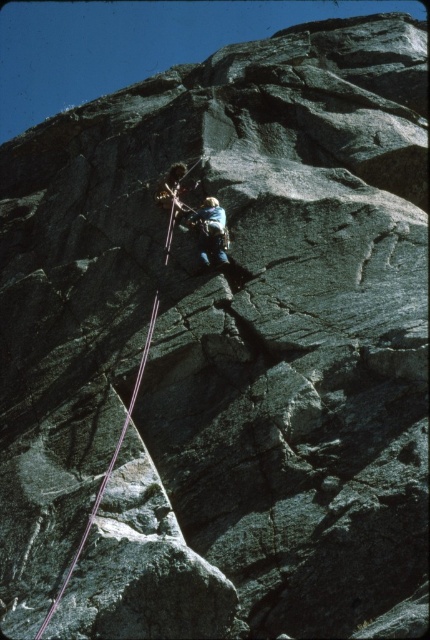
You are a rock climber assessing the climbing route. You notice two points on the rock face marked as point A at coordinates point A at point (131, 417) and point B at point (224, 241). Which point is closer to you as you stand at the base of the cliff?

Point A at point (131, 417) is closer to the viewer than point B at point (224, 241), so point A is closer to you as you stand at the base of the cliff.

You are a climber trying to reach the top of the cliff. You notice the purple synthetic rope at center. Based on its position, can you determine if it is directly below or above your current position?

The purple synthetic rope at center is located at point coordinates that are lower than your current position, so it is below you.

You are a safety inspector assessing the climbing setup. The safety regulations state that the distance between the purple synthetic rope at center and the camouflage fabric climbing harness at center must not exceed 3.5 meters. Is this setup compliant with the regulations?

The purple synthetic rope at center and the camouflage fabric climbing harness at center are 4.00 meters apart, which exceeds the maximum allowed distance of 3.5 meters. Therefore, the setup does not comply with the safety regulations.